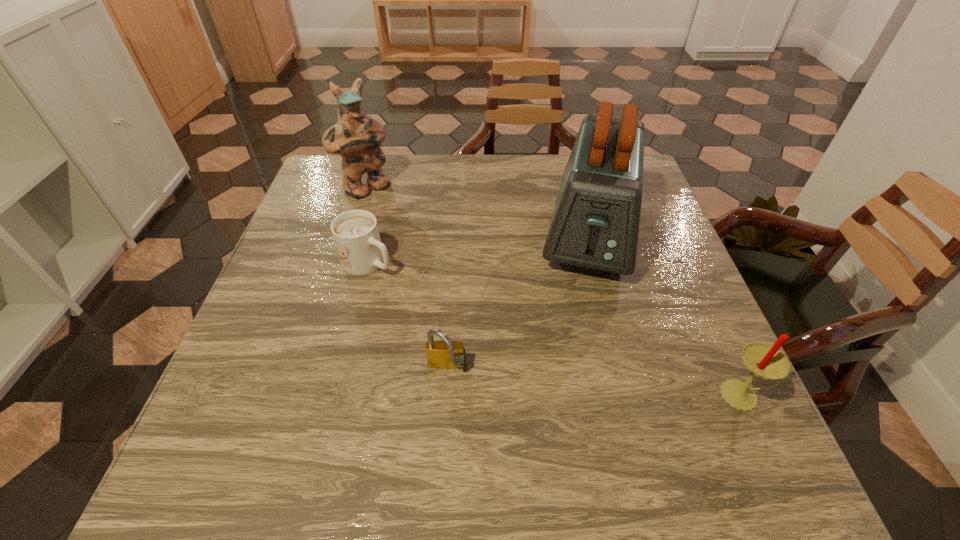
Locate an element on the screen. free spot on the desktop that is between the padlock and the third tallest object and is positioned on the front-facing side of the second object from right to left is located at coordinates (567, 380).

Where is `free space on the desktop that is between the third object from right to left and the rightmost object and is positioned on the front-facing side of the figurine`? The image size is (960, 540). free space on the desktop that is between the third object from right to left and the rightmost object and is positioned on the front-facing side of the figurine is located at coordinates (556, 379).

Identify the location of free space on the desktop that is between the padlock and the candle and is positioned on the side with the handle of the cappuccino. This screenshot has width=960, height=540. (552, 378).